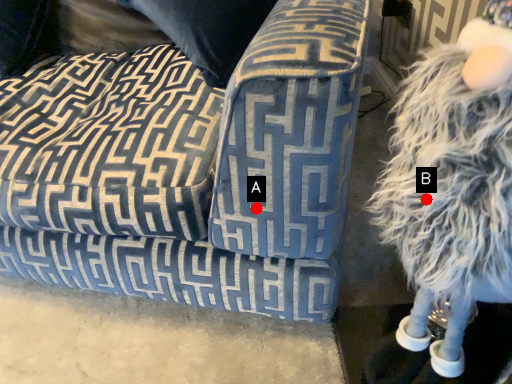
Question: Two points are circled on the image, labeled by A and B beside each circle. Among these points, which one is nearest to the camera?

Choices:
 (A) A is closer
 (B) B is closer

Answer: (B)